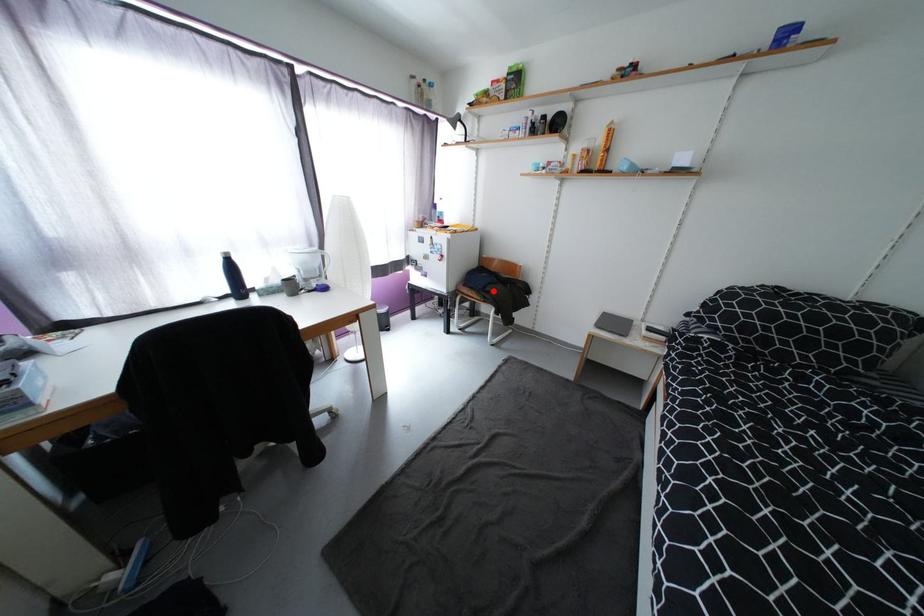
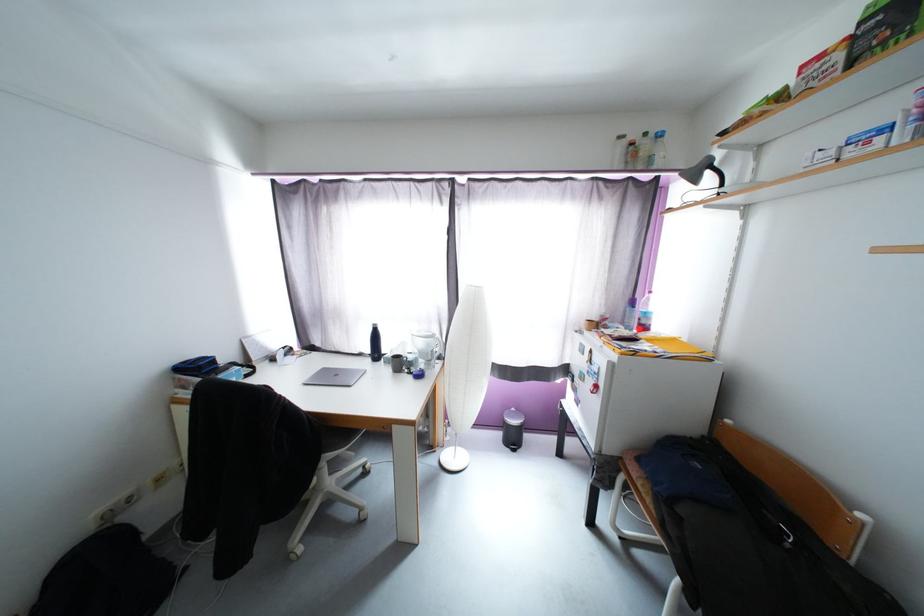
Locate, in the second image, the point that corresponds to the highlighted location in the first image.

(687, 512)